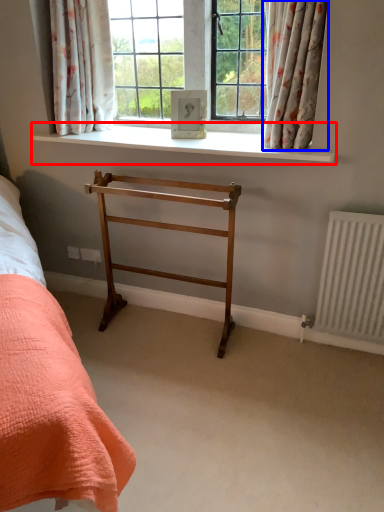
Question: Which object appears closest to the camera in this image, window sill (highlighted by a red box) or curtain (highlighted by a blue box)?

Choices:
 (A) window sill
 (B) curtain

Answer: (B)